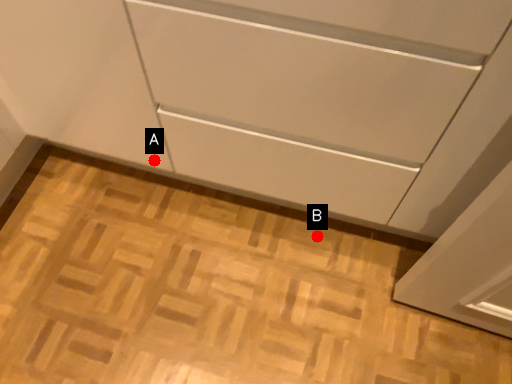
Question: Two points are circled on the image, labeled by A and B beside each circle. Which point is farther to the camera?

Choices:
 (A) A is further
 (B) B is further

Answer: (B)